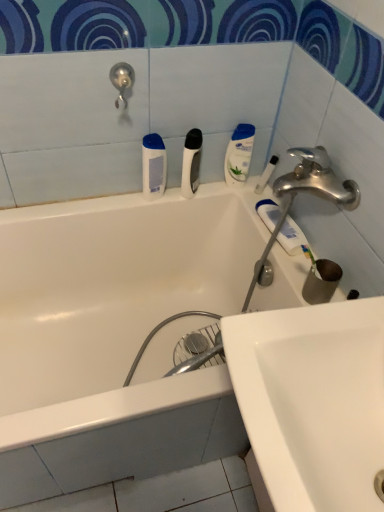
The width and height of the screenshot is (384, 512). What do you see at coordinates (239, 155) in the screenshot?
I see `white glossy lotion at upper right, the third toiletry from the left` at bounding box center [239, 155].

The width and height of the screenshot is (384, 512). I want to click on white matte toothpaste at upper right, so click(291, 237).

The height and width of the screenshot is (512, 384). I want to click on clear plastic toothbrush at upper right, acting as the first toiletry starting from the right, so tap(266, 174).

Image resolution: width=384 pixels, height=512 pixels. Identify the location of white matte bottle at upper center, which is the fourth toiletry from right to left. (153, 166).

What is the approximate width of white glossy sink at lower right?

44.55 centimeters.

Identify the location of white glossy bathtub at upper center. The height and width of the screenshot is (512, 384). (116, 337).

Describe the element at coordinates (122, 81) in the screenshot. Image resolution: width=384 pixels, height=512 pixels. I see `satin nickel showerhead at upper left` at that location.

The width and height of the screenshot is (384, 512). I want to click on white glossy lotion at upper right, the third toiletry from the left, so click(x=239, y=155).

Is white glossy bathtub at upper center behind white matte bottle at upper center, which is the fourth toiletry from right to left?

No, it is in front of white matte bottle at upper center, which is the fourth toiletry from right to left.

From a real-world perspective, is white glossy bathtub at upper center beneath white matte bottle at upper center, which is the fourth toiletry from right to left?

Yes, from a real-world perspective, white glossy bathtub at upper center is beneath white matte bottle at upper center, which is the fourth toiletry from right to left.

Is there a large distance between white glossy bathtub at upper center and white matte bottle at upper center, which is the fourth toiletry from right to left?

white glossy bathtub at upper center is near white matte bottle at upper center, which is the fourth toiletry from right to left, not far away.

Is point (144, 376) positioned behind point (146, 169)?

Yes, point (144, 376) is behind point (146, 169).

In the image, is clear plastic toothbrush at upper right, marked as the fourth toiletry in a left-to-right arrangement, on the left side or the right side of white glossy bathtub at upper center?

clear plastic toothbrush at upper right, marked as the fourth toiletry in a left-to-right arrangement, is to the right of white glossy bathtub at upper center.

Is clear plastic toothbrush at upper right, acting as the first toiletry starting from the right, not near white glossy bathtub at upper center?

clear plastic toothbrush at upper right, acting as the first toiletry starting from the right, is near white glossy bathtub at upper center, not far away.

Considering the relative sizes of clear plastic toothbrush at upper right, acting as the first toiletry starting from the right, and white glossy bathtub at upper center in the image provided, is clear plastic toothbrush at upper right, acting as the first toiletry starting from the right, bigger than white glossy bathtub at upper center?

No, clear plastic toothbrush at upper right, acting as the first toiletry starting from the right, is not bigger than white glossy bathtub at upper center.

Is white matte bottle at upper center, arranged as the first toiletry when viewed from the left, bigger than white matte toothpaste at upper right?

Yes, white matte bottle at upper center, arranged as the first toiletry when viewed from the left, is bigger than white matte toothpaste at upper right.

Can you confirm if white matte bottle at upper center, arranged as the first toiletry when viewed from the left, is shorter than white matte toothpaste at upper right?

In fact, white matte bottle at upper center, arranged as the first toiletry when viewed from the left, may be taller than white matte toothpaste at upper right.

From a real-world perspective, between white matte bottle at upper center, which is the fourth toiletry from right to left, and white matte toothpaste at upper right, who is vertically lower?

white matte toothpaste at upper right.

From the image's perspective, is white matte bottle at upper center, arranged as the first toiletry when viewed from the left, below white matte toothpaste at upper right?

Actually, white matte bottle at upper center, arranged as the first toiletry when viewed from the left, appears above white matte toothpaste at upper right in the image.

From a real-world perspective, is satin nickel showerhead at upper left located higher than white glossy lotion at upper right, which is the second toiletry from right to left?

Yes, from a real-world perspective, satin nickel showerhead at upper left is over white glossy lotion at upper right, which is the second toiletry from right to left

Does satin nickel showerhead at upper left have a larger size compared to white glossy lotion at upper right, which is the second toiletry from right to left?

Incorrect, satin nickel showerhead at upper left is not larger than white glossy lotion at upper right, which is the second toiletry from right to left.

Considering the positions of point (124, 105) and point (235, 151), is point (124, 105) closer or farther from the camera than point (235, 151)?

Clearly, point (124, 105) is closer to the camera than point (235, 151).

In the scene shown: How different are the orientations of satin nickel showerhead at upper left and white glossy bathtub at upper center in degrees?

satin nickel showerhead at upper left and white glossy bathtub at upper center are facing 0.000272 degrees away from each other.

Could you tell me if satin nickel showerhead at upper left is turned towards white glossy bathtub at upper center?

No, satin nickel showerhead at upper left is not aimed at white glossy bathtub at upper center.

Which is in front, point (119, 79) or point (90, 364)?

The point (119, 79) is closer to the camera.

Considering the positions of objects satin nickel showerhead at upper left and white glossy bathtub at upper center in the image provided, who is behind, satin nickel showerhead at upper left or white glossy bathtub at upper center?

Positioned behind is satin nickel showerhead at upper left.

What's the angular difference between white glossy bathtub at upper center and white matte razor at center, the 2th toiletry when ordered from left to right,'s facing directions?

The angle between the facing direction of white glossy bathtub at upper center and the facing direction of white matte razor at center, the 2th toiletry when ordered from left to right, is 36.2 degrees.

Looking at this image, from the image's perspective, is white glossy bathtub at upper center above or below white matte razor at center, the 2th toiletry when ordered from left to right?

From the image's perspective, white glossy bathtub at upper center appears below white matte razor at center, the 2th toiletry when ordered from left to right.

Is white glossy bathtub at upper center far from white matte razor at center, arranged as the 3th toiletry when viewed from the right?

white glossy bathtub at upper center is actually quite close to white matte razor at center, arranged as the 3th toiletry when viewed from the right.

Does clear plastic toothbrush at upper right, marked as the fourth toiletry in a left-to-right arrangement, contain satin nickel showerhead at upper left?

Actually, satin nickel showerhead at upper left is outside clear plastic toothbrush at upper right, marked as the fourth toiletry in a left-to-right arrangement.

Which object is wider, clear plastic toothbrush at upper right, acting as the first toiletry starting from the right, or satin nickel showerhead at upper left?

With larger width is satin nickel showerhead at upper left.

From the picture: Which of these two, clear plastic toothbrush at upper right, acting as the first toiletry starting from the right, or satin nickel showerhead at upper left, is bigger?

satin nickel showerhead at upper left.

Image resolution: width=384 pixels, height=512 pixels. In order to click on bathtub in front of the white matte bottle at upper center, arranged as the first toiletry when viewed from the left in this screenshot , I will do `click(116, 337)`.

Image resolution: width=384 pixels, height=512 pixels. I want to click on bathtub on the left of the clear plastic toothbrush at upper right, acting as the first toiletry starting from the right, so click(116, 337).

Considering their positions, is white matte toothpaste at upper right positioned further to satin nickel showerhead at upper left than white glossy sink at lower right?

white glossy sink at lower right lies further to satin nickel showerhead at upper left than the other object.

Which object lies nearer to the anchor point white matte toothpaste at upper right, clear plastic toothbrush at upper right, acting as the first toiletry starting from the right, or white glossy bathtub at upper center?

clear plastic toothbrush at upper right, acting as the first toiletry starting from the right.

From the image, which object appears to be nearer to white glossy bathtub at upper center, satin nickel showerhead at upper left or clear plastic toothbrush at upper right, marked as the fourth toiletry in a left-to-right arrangement?

clear plastic toothbrush at upper right, marked as the fourth toiletry in a left-to-right arrangement, is positioned closer to the anchor white glossy bathtub at upper center.

Based on the photo, looking at the image, which one is located closer to white glossy sink at lower right, clear plastic toothbrush at upper right, marked as the fourth toiletry in a left-to-right arrangement, or white matte razor at center, arranged as the 3th toiletry when viewed from the right?

clear plastic toothbrush at upper right, marked as the fourth toiletry in a left-to-right arrangement.

Based on their spatial positions, is white glossy lotion at upper right, which is the second toiletry from right to left, or white matte toothpaste at upper right closer to satin nickel showerhead at upper left?

The object closer to satin nickel showerhead at upper left is white glossy lotion at upper right, which is the second toiletry from right to left.

Which object lies further to the anchor point white glossy lotion at upper right, the third toiletry from the left, white glossy bathtub at upper center or white matte razor at center, arranged as the 3th toiletry when viewed from the right?

white glossy bathtub at upper center is further to white glossy lotion at upper right, the third toiletry from the left.

Which object lies further to the anchor point clear plastic toothbrush at upper right, acting as the first toiletry starting from the right, white matte bottle at upper center, arranged as the first toiletry when viewed from the left, or white matte toothpaste at upper right?

Among the two, white matte bottle at upper center, arranged as the first toiletry when viewed from the left, is located further to clear plastic toothbrush at upper right, acting as the first toiletry starting from the right.

Which object lies nearer to the anchor point clear plastic toothbrush at upper right, acting as the first toiletry starting from the right, white glossy bathtub at upper center or white matte bottle at upper center, which is the fourth toiletry from right to left?

white matte bottle at upper center, which is the fourth toiletry from right to left, is positioned closer to the anchor clear plastic toothbrush at upper right, acting as the first toiletry starting from the right.

The width and height of the screenshot is (384, 512). In order to click on toothpaste positioned between white glossy bathtub at upper center and clear plastic toothbrush at upper right, acting as the first toiletry starting from the right, from near to far in this screenshot , I will do `click(291, 237)`.

Where is `toiletry between clear plastic toothbrush at upper right, marked as the fourth toiletry in a left-to-right arrangement, and white glossy bathtub at upper center from top to bottom`? The height and width of the screenshot is (512, 384). toiletry between clear plastic toothbrush at upper right, marked as the fourth toiletry in a left-to-right arrangement, and white glossy bathtub at upper center from top to bottom is located at coordinates (153, 166).

This screenshot has height=512, width=384. I want to click on toiletry between white matte razor at center, arranged as the 3th toiletry when viewed from the right, and clear plastic toothbrush at upper right, acting as the first toiletry starting from the right, from left to right, so click(239, 155).

The image size is (384, 512). Find the location of `shower positioned between white glossy sink at lower right and white glossy lotion at upper right, which is the second toiletry from right to left, from near to far`. shower positioned between white glossy sink at lower right and white glossy lotion at upper right, which is the second toiletry from right to left, from near to far is located at coordinates (122, 81).